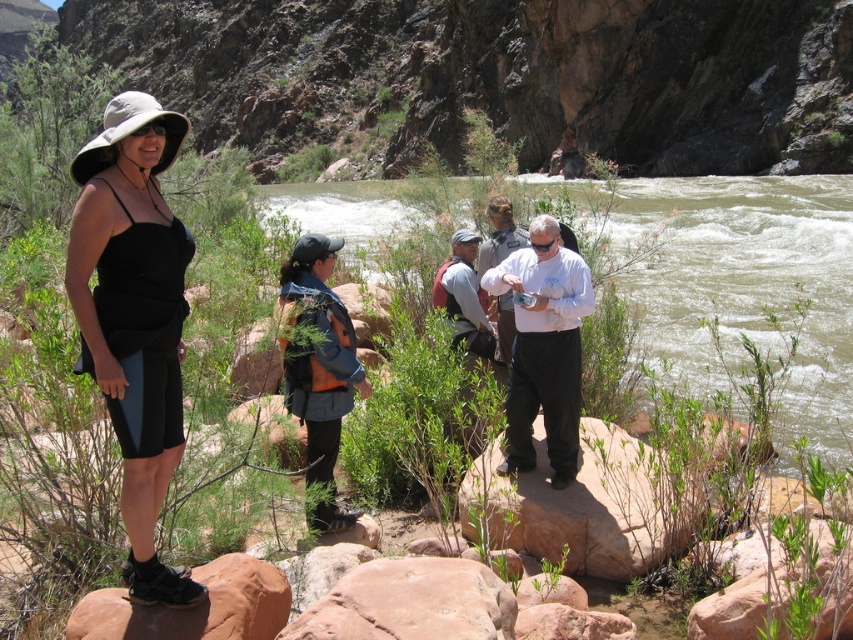
You are a photographer trying to capture the scene with a camera that has a 100mm lens. The camera is positioned at point A, and you want to focus on the matte black dress at center. Based on the coordinates provided, will the dress be in the center of your frame?

The matte black dress at center is located at coordinates point [134,316], which is very close to the center of the frame. Since 0.495 is nearly 0.5 on the x axis and 0.158 is lower on the y axis, it will be slightly below the exact center but still within the central area of the frame.